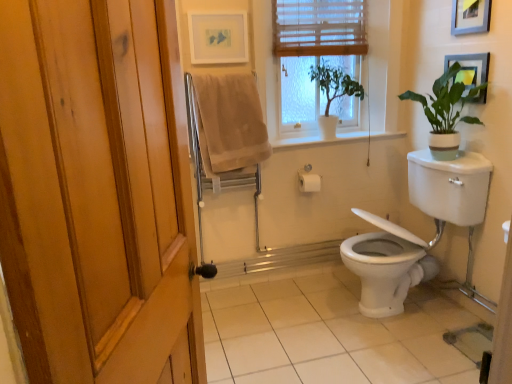
Find the location of a particular element. vacant area on top of beige cotton towel at upper center (from a real-world perspective) is located at coordinates (224, 72).